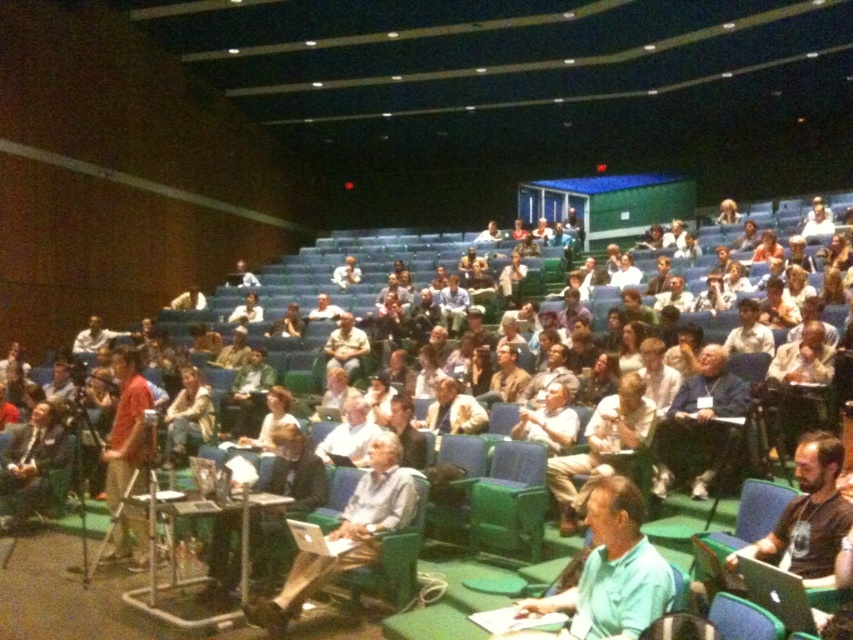
Question: In this image, where is green matte shirt at center located relative to light brown leather jacket at lower left?

Choices:
 (A) right
 (B) left

Answer: (A)

Question: Which of the following is the farthest from the observer?

Choices:
 (A) green matte shirt at center
 (B) light brown leather jacket at center

Answer: (B)

Question: Does matte orange shirt at center appear on the left side of light brown leather jacket at lower left?

Choices:
 (A) yes
 (B) no

Answer: (B)

Question: Considering the real-world distances, which object is closest to the light gray fabric shirt at center?

Choices:
 (A) light brown leather jacket at center
 (B) green matte shirt at center
 (C) light brown leather jacket at lower left

Answer: (B)

Question: Among these points, which one is nearest to the camera?

Choices:
 (A) (352, 284)
 (B) (393, 528)

Answer: (B)

Question: Where is light gray fabric shirt at center located in relation to light brown leather jacket at lower left in the image?

Choices:
 (A) above
 (B) below

Answer: (B)